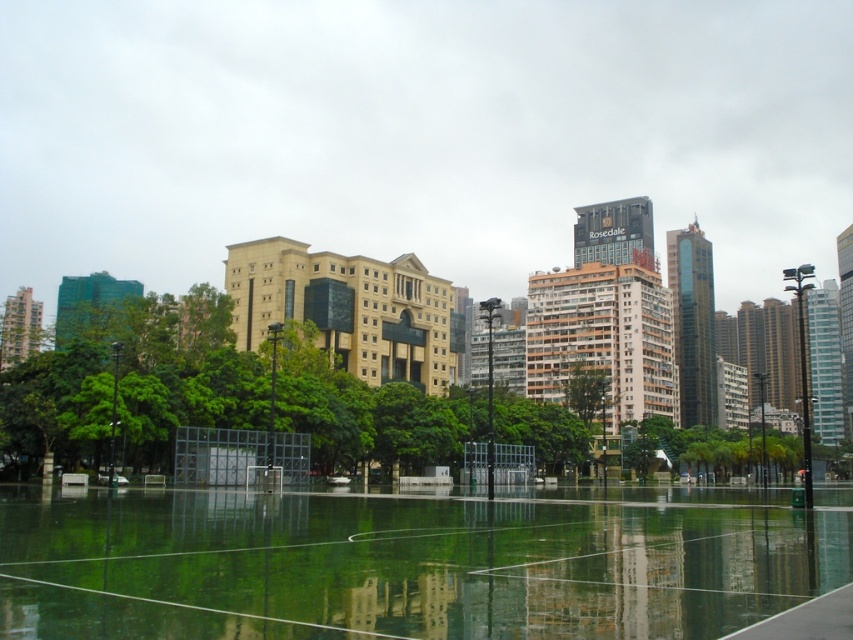
You are standing at the point marked by the coordinates point (x=407, y=564) in the image. What is the name of the object you are standing on?

The transparent glass court at center is represented by point (x=407, y=564), so you are standing on the transparent glass court at center.

You are a photographer standing at the camera position in the scene. You want to capture a clear photo of the transparent glass court at center. Considering the distance, what is the minimum focal length required for your camera lens to focus on the court without blurring?

The transparent glass court at center is 15.78 meters away from camera. To focus on the court at that distance, the camera lens should have a minimum focal length of 15.78 meters to avoid blurring.

You are standing at the entrance of the urban area shown in the image. You want to locate the transparent glass court at center. Based on its 2D coordinates, in which direction should you walk from your current position to reach it?

The transparent glass court at center is located at coordinates point (407, 564). Since the x coordinate is 0.883, which is closer to the right edge of the image, and the y coordinate is 0.478, closer to the bottom, you should walk towards the lower right direction to reach it.